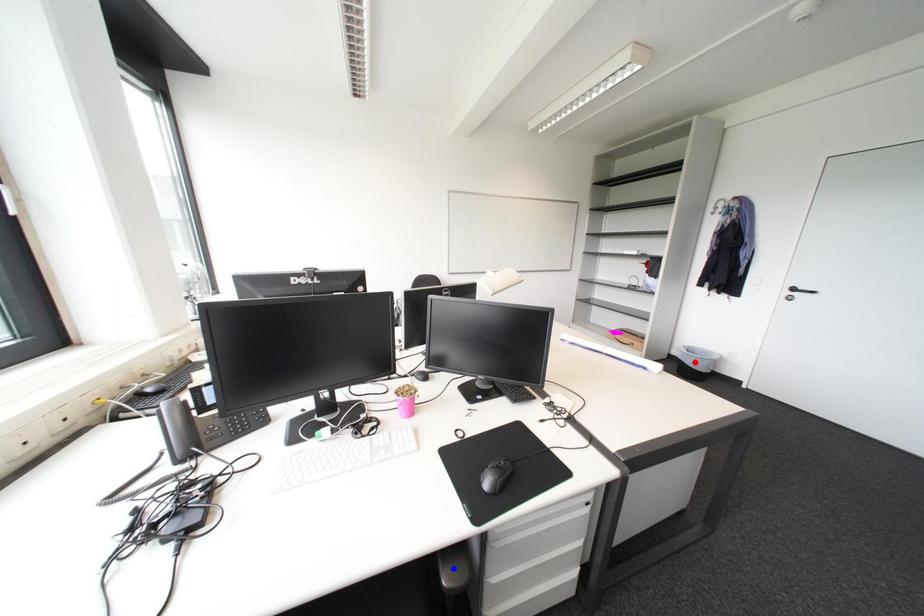
Question: Two points are marked on the image. Which point is closer to the camera?

Choices:
 (A) Blue point is closer.
 (B) Red point is closer.

Answer: (A)